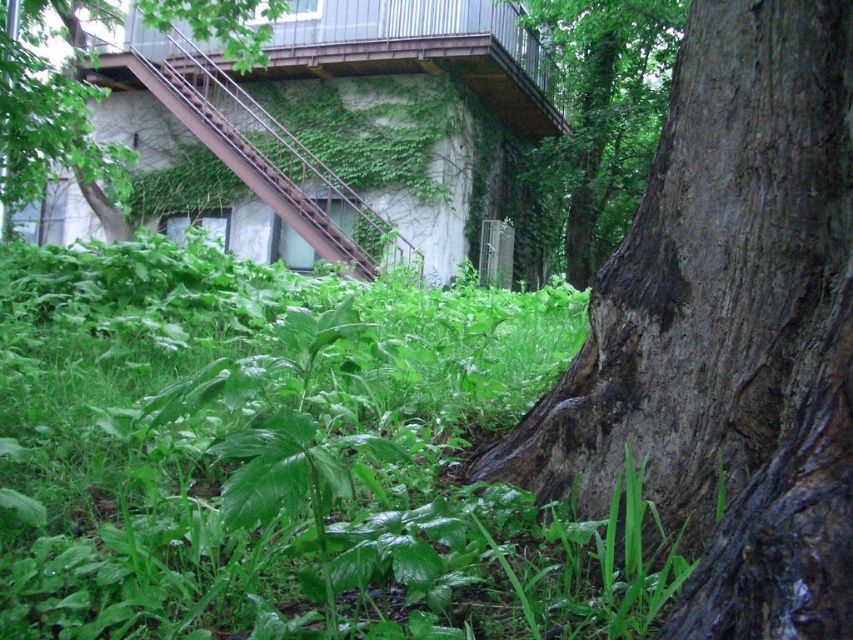
You are standing at the center of the image and see the point labeled as point [283,458]. What object is located at that point?

The point [283,458] corresponds to green leafy grass at center.

You are standing in the outdoor scene described and want to take a photo of the green leafy tree at upper left. Given that your camera has a zoom lens, which direction should you point your camera to capture the tree in the frame?

The green leafy tree at upper left is located at point coordinates (54, 113), which is towards the upper left direction from your current position. Point your camera towards the upper left to capture it.